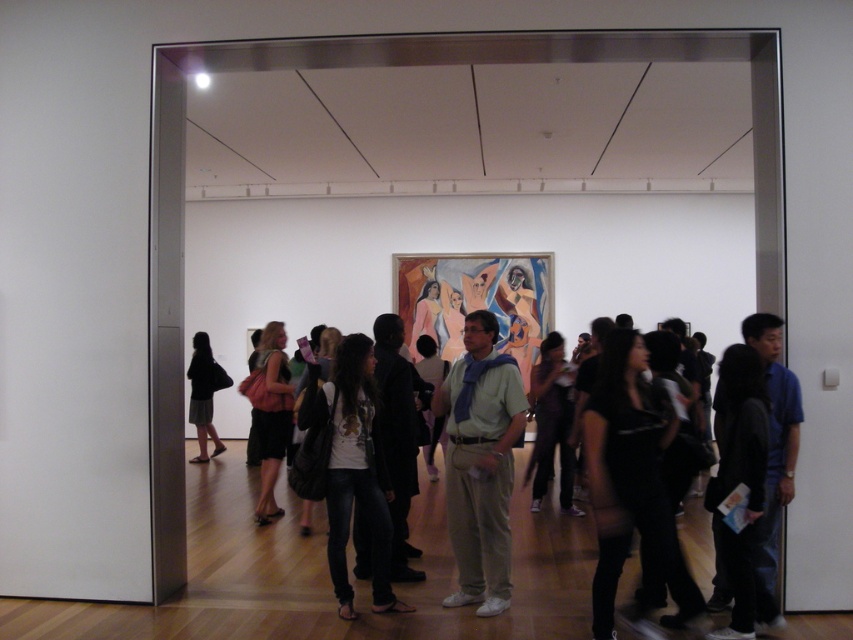
In the scene shown: You are an art enthusiast standing in the gallery. You see a light green cotton shirt at center and a black fabric bag at left. Which object is higher in the image?

The light green cotton shirt at center is taller than the black fabric bag at left.